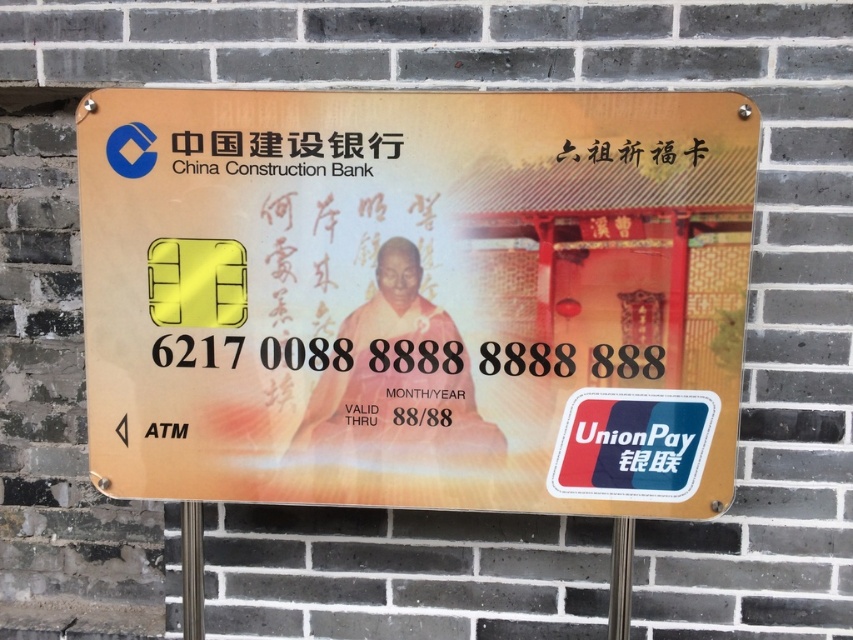
Question: Considering the relative positions of white glossy unionpay sticker at center and black plastic text at upper center in the image provided, where is white glossy unionpay sticker at center located with respect to black plastic text at upper center?

Choices:
 (A) right
 (B) left

Answer: (A)

Question: Is metallic pole at lower center positioned at the back of metallic pole at center?

Choices:
 (A) no
 (B) yes

Answer: (B)

Question: Which object appears farthest from the camera in this image?

Choices:
 (A) metallic pole at lower center
 (B) metallic pole at center
 (C) gold plastic card at center

Answer: (A)

Question: Which point is closer to the camera?

Choices:
 (A) (368, 172)
 (B) (567, 291)
 (C) (639, 413)

Answer: (A)

Question: Does black plastic text at upper center come behind metallic pole at lower center?

Choices:
 (A) yes
 (B) no

Answer: (B)

Question: Which point is closer to the camera?

Choices:
 (A) white glossy unionpay sticker at center
 (B) gold plastic card at center
 (C) black plastic text at upper center
 (D) metallic pole at center

Answer: (B)